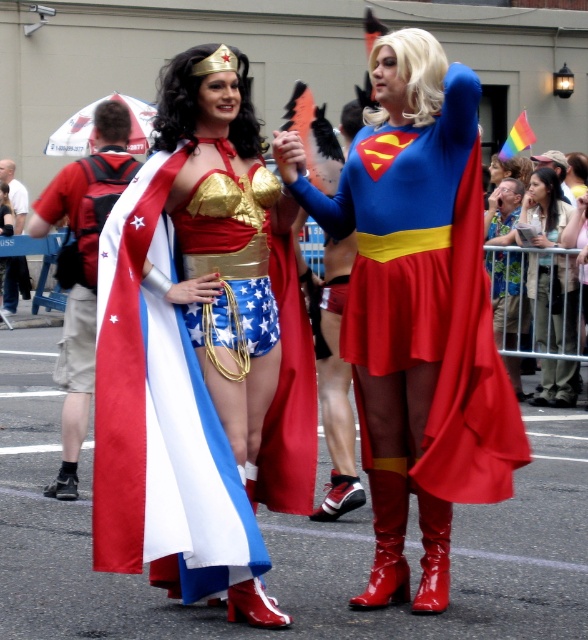
You are a photographer at the parade trying to capture both the shiny metallic boots at center and the shiny red boots at center in a single photo. If your camera can only focus on objects within a 10 cm width, will both pairs of boots fit in the frame?

The shiny metallic boots at center are wider than the shiny red boots at center. Since the camera can focus on objects within a 10 cm width, both pairs of boots might fit if their combined width is under 10 cm. However, without knowing the exact width of each, it is uncertain. The description only states that the metallic boots are wider than the red ones, but not by how much.

You are a photographer at the parade who needs to capture a photo of both the shiny metallic boots at center and the shiny red boots at center in the same frame. Your camera has a maximum focus range of 20 feet. Can you fit both pairs of boots into the frame without moving your position?

The distance between the shiny metallic boots at center and the shiny red boots at center is 19.32 feet, which is within the camera maximum focus range of 20 feet. Therefore, you can capture both pairs of boots in the same frame without moving.

You are a photographer at the parade. You want to take a photo that includes both the shiny blue fabric cape at center and the shiny red boots at center. Which object should you focus on first to ensure both are in frame?

You should focus on the shiny blue fabric cape at center first since it is taller than the shiny red boots at center, ensuring that both objects will be captured within the frame.